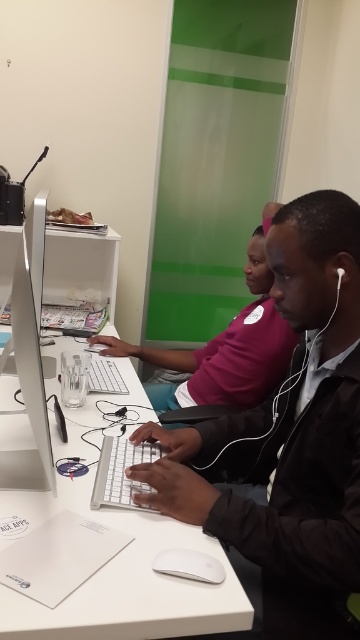
Consider the image. You are a tailor who needs to determine which clothing item requires a wider fabric width for customization. Based on the image, which of the two items, the black matte jacket at center or the matte black shirt at center, would need a larger fabric width?

The matte black shirt at center requires a larger fabric width since its width is greater than the black matte jacket at center according to the description.

You are trying to determine if the black matte jacket at center can be moved to the side without disturbing the white plastic computer desk at center. Based on their relative sizes, is this feasible?

The black matte jacket at center has a lesser width compared to the white plastic computer desk at center, so it is feasible to move the black matte jacket at center to the side without disturbing the white plastic computer desk at center due to its smaller size.

You are a person trying to decide which clothing item to wear for a video call. You have a black matte jacket at center and a matte black shirt at center. Which one would be more visible to the camera if you wear it?

The black matte jacket at center is taller than the matte black shirt at center, so it would be more visible to the camera.